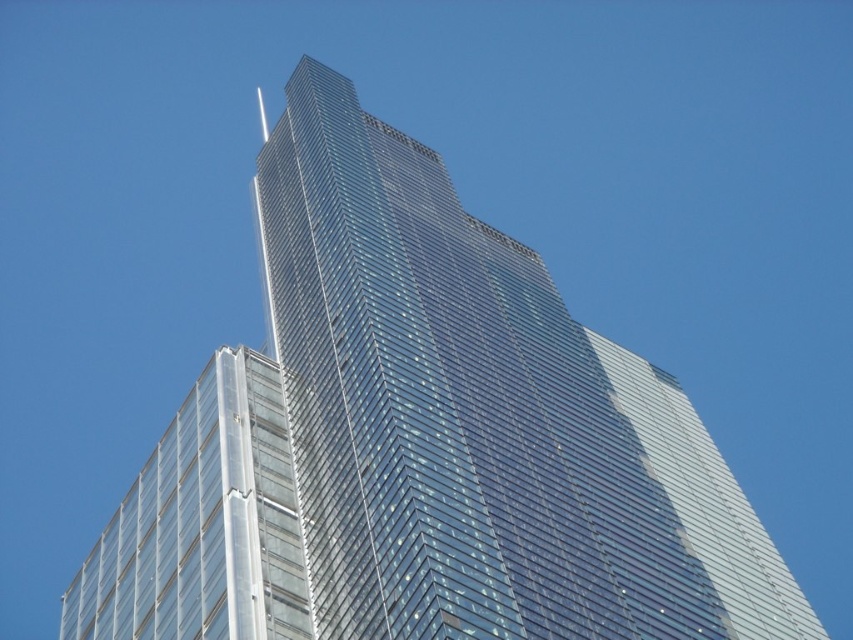
Question: Among these objects, which one is farthest from the camera?

Choices:
 (A) transparent glass building at lower left
 (B) transparent glass tower at center

Answer: (A)

Question: Is transparent glass tower at center further to camera compared to transparent glass building at lower left?

Choices:
 (A) yes
 (B) no

Answer: (B)

Question: Which of the following is the closest to the observer?

Choices:
 (A) transparent glass building at lower left
 (B) transparent glass tower at center

Answer: (B)

Question: Where is transparent glass tower at center located in relation to transparent glass building at lower left in the image?

Choices:
 (A) above
 (B) below

Answer: (A)

Question: Does transparent glass tower at center have a lesser width compared to transparent glass building at lower left?

Choices:
 (A) no
 (B) yes

Answer: (B)

Question: Which point appears farthest from the camera in this image?

Choices:
 (A) (321, 356)
 (B) (274, 573)

Answer: (A)